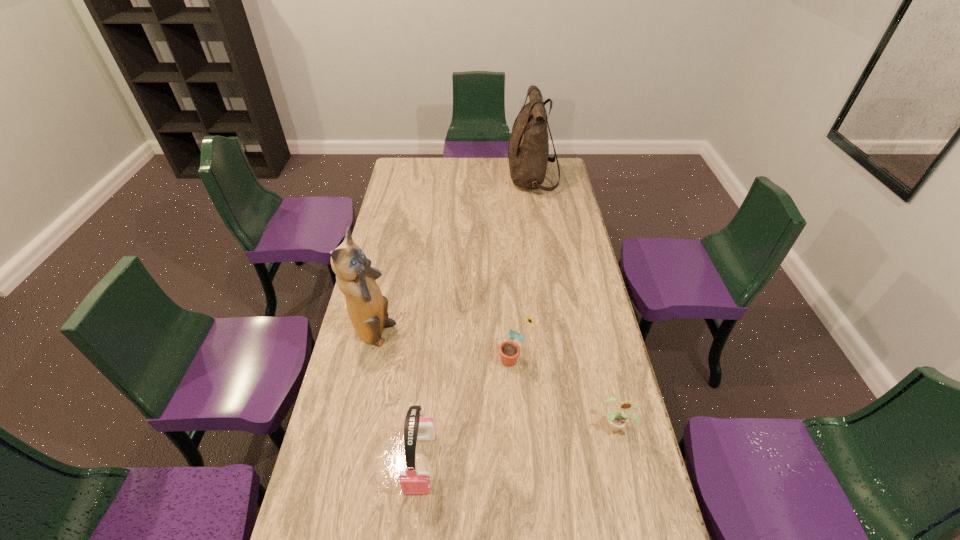
Locate an element on the screen. Image resolution: width=960 pixels, height=540 pixels. vacant area between the left sunflower and the fourth object from right to left is located at coordinates (468, 411).

Find the location of a particular element. The height and width of the screenshot is (540, 960). vacant space that's between the nearer sunflower and the farthest object is located at coordinates (574, 302).

Identify the location of unoccupied position between the farther sunflower and the fourth object from right to left. (468, 411).

Image resolution: width=960 pixels, height=540 pixels. What are the coordinates of `empty space between the second object from left to right and the shortest object` in the screenshot? It's located at (518, 444).

Select which object is the fourth closest to the backpack. Please provide its 2D coordinates. Your answer should be formatted as a tuple, i.e. [(x, y)], where the tuple contains the x and y coordinates of a point satisfying the conditions above.

[(417, 427)]

Choose which object is the third nearest neighbor to the shorter sunflower. Please provide its 2D coordinates. Your answer should be formatted as a tuple, i.e. [(x, y)], where the tuple contains the x and y coordinates of a point satisfying the conditions above.

[(367, 308)]

Identify the location of vacant space that satisfies the following two spatial constraints: 1. on the flower of the left sunflower; 2. on the outer surface of the earphone. This screenshot has width=960, height=540. (522, 462).

You are a GUI agent. You are given a task and a screenshot of the screen. Output one action in this format:
    pyautogui.click(x=<x>, y=<y>)
    Task: Click on the free spot that satisfies the following two spatial constraints: 1. on the flower of the left sunflower; 2. on the outer surface of the earphone
    Image resolution: width=960 pixels, height=540 pixels.
    Given the screenshot: What is the action you would take?
    pyautogui.click(x=522, y=462)

Locate an element on the screen. vacant space that satisfies the following two spatial constraints: 1. on the flower of the taller sunflower; 2. on the outer surface of the earphone is located at coordinates (522, 462).